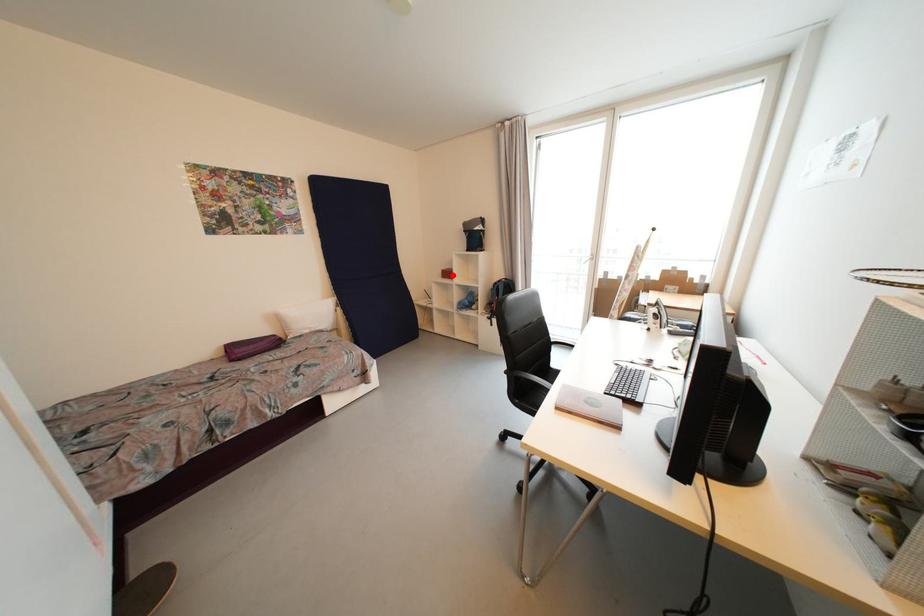
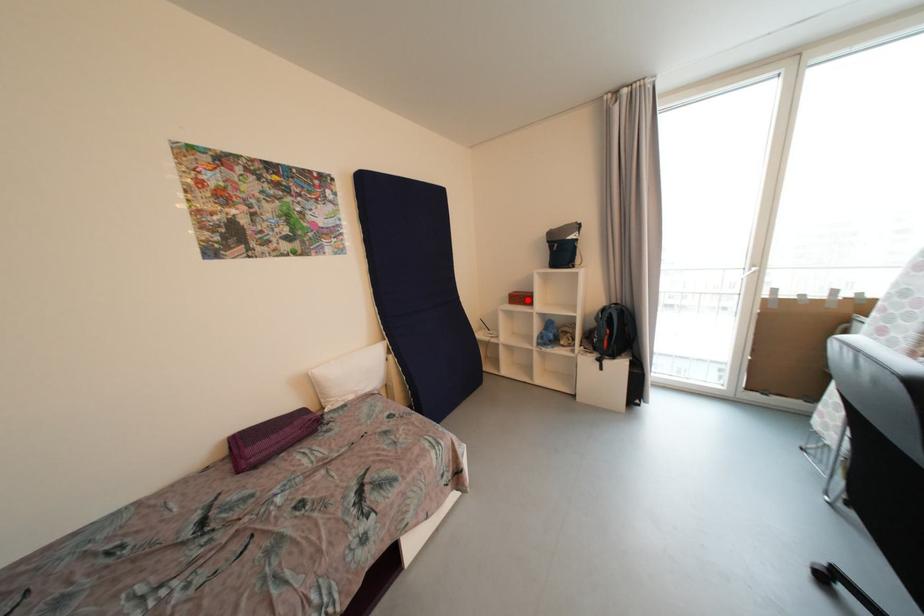
I am providing you with two images of the same scene from different viewpoints. A red point is marked on the first image and another point is marked on the second image. Is the marked point in image1 the same physical position as the marked point in image2?

Yes